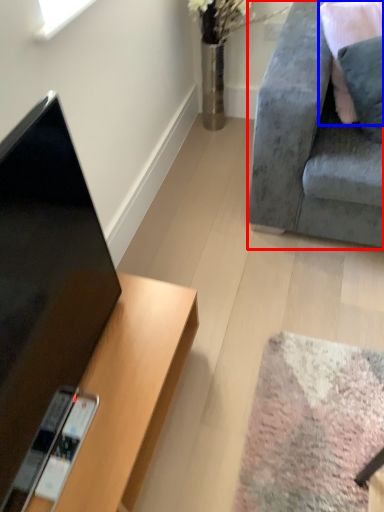
Question: Which object appears closest to the camera in this image, studio couch (highlighted by a red box) or pillow (highlighted by a blue box)?

Choices:
 (A) studio couch
 (B) pillow

Answer: (A)